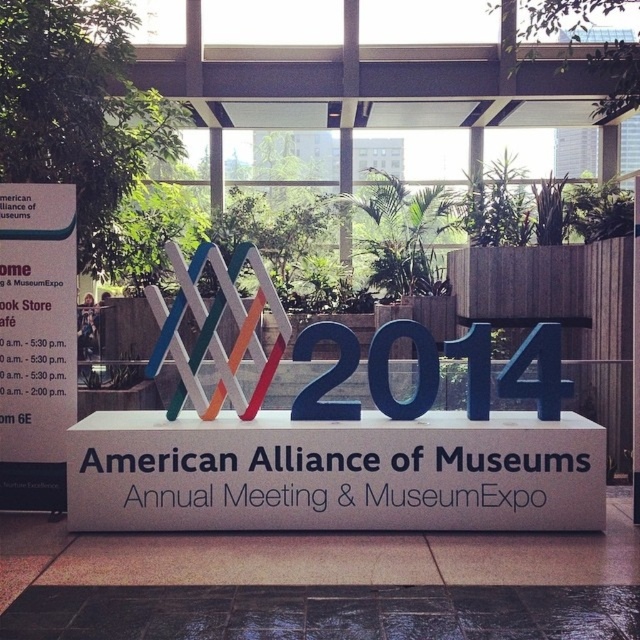
In the scene shown: What is the relationship between the width of the white matte sign at center and the black tile floor at lower center?

The white matte sign at center is wider than the black tile floor at lower center.

You are an event planner standing at the entrance of the venue and need to determine the best spot to place a new promotional banner. The banner is the same size as the black tile floor at lower center. Can you place it next to the white matte sign at center without overlapping?

The white matte sign at center is larger in size than the black tile floor at lower center. Since the banner is the same size as the black tile floor at lower center, there should be enough space to place it next to the white matte sign at center without overlapping.